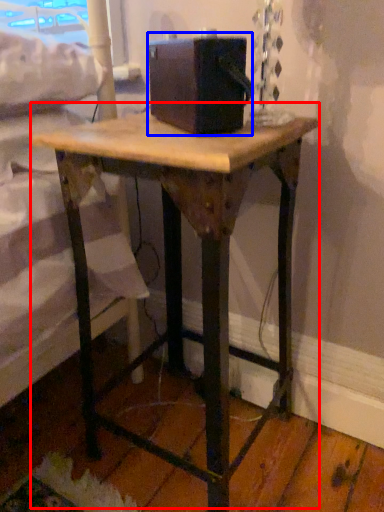
Question: Among these objects, which one is farthest to the camera, table (highlighted by a red box) or box (highlighted by a blue box)?

Choices:
 (A) table
 (B) box

Answer: (B)